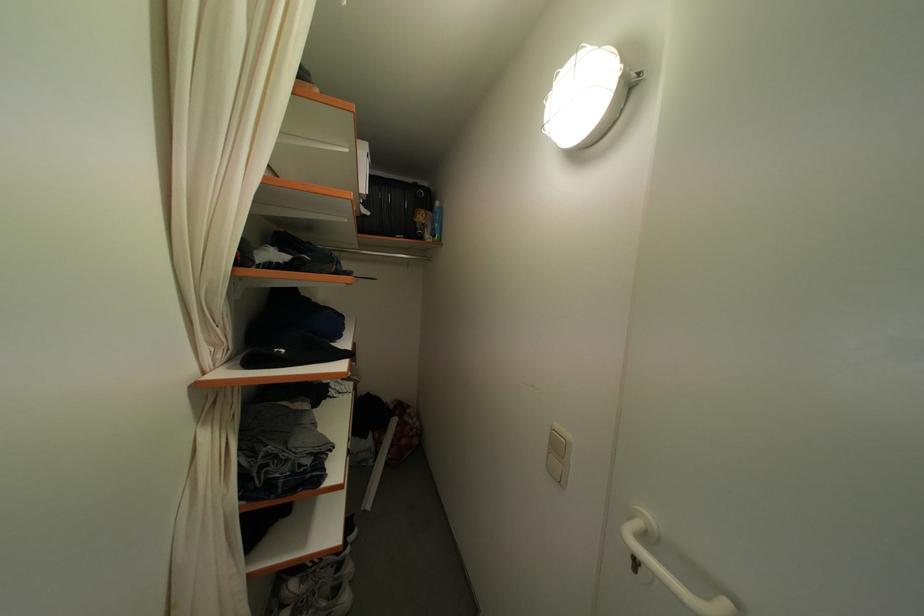
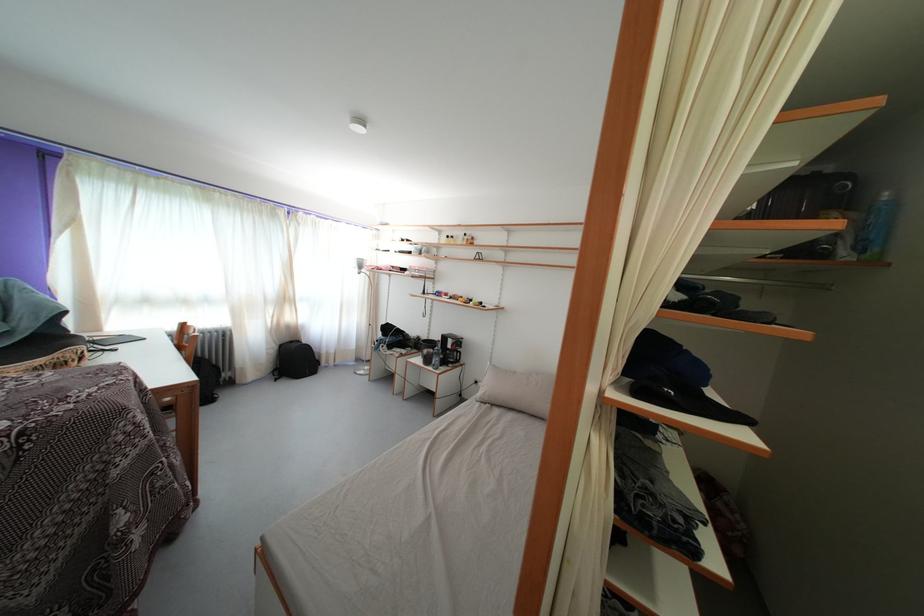
Question: How did the camera likely rotate?

Choices:
 (A) Left
 (B) Right
 (C) Up
 (D) Down

Answer: (A)